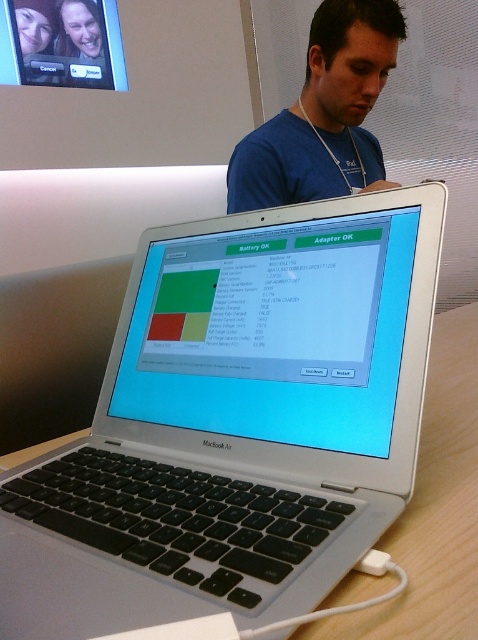
Question: Which of the following is the closest to the observer?

Choices:
 (A) silver metallic laptop at center
 (B) blue fabric shirt at center
 (C) silver/black keyboard at center

Answer: (C)

Question: Which object is the closest to the silver/black keyboard at center?

Choices:
 (A) blue fabric shirt at center
 (B) silver metallic laptop at center

Answer: (B)

Question: Does silver metallic laptop at center have a lesser width compared to blue fabric shirt at center?

Choices:
 (A) yes
 (B) no

Answer: (A)

Question: Is silver/black keyboard at center behind silver metallic laptop at center?

Choices:
 (A) no
 (B) yes

Answer: (A)

Question: Which point appears farthest from the camera in this image?

Choices:
 (A) (153, 492)
 (B) (248, 253)

Answer: (B)

Question: Does silver/black keyboard at center have a lesser width compared to silver metallic laptop at center?

Choices:
 (A) yes
 (B) no

Answer: (B)